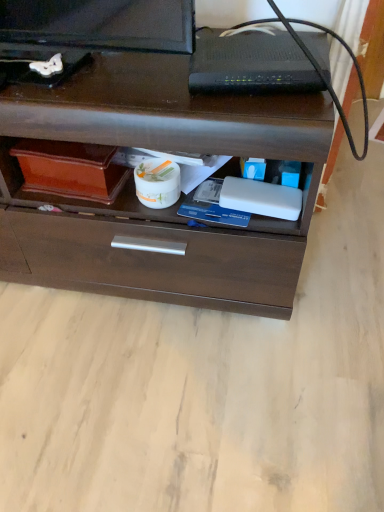
This screenshot has height=512, width=384. Describe the element at coordinates (251, 64) in the screenshot. I see `black plastic router at upper center` at that location.

Image resolution: width=384 pixels, height=512 pixels. What are the coordinates of `black plastic router at upper center` in the screenshot? It's located at point(251,64).

What is the approximate width of black plastic router at upper center?

7.03 inches.

The image size is (384, 512). What do you see at coordinates (163, 209) in the screenshot? I see `brown wood chest of drawers at center` at bounding box center [163, 209].

You are a GUI agent. You are given a task and a screenshot of the screen. Output one action in this format:
    pyautogui.click(x=<x>, y=<y>)
    Task: Click on the brown wood chest of drawers at center
    
    Given the screenshot: What is the action you would take?
    pos(163,209)

In order to click on black plastic router at upper center in this screenshot , I will do `click(251, 64)`.

Is brown wood chest of drawers at center at the right side of black plastic router at upper center?

No, brown wood chest of drawers at center is not to the right of black plastic router at upper center.

Who is more distant, brown wood chest of drawers at center or black plastic router at upper center?

Positioned behind is black plastic router at upper center.

Is point (53, 267) in front of point (200, 87)?

No, (53, 267) is further to viewer.

From the image's perspective, does brown wood chest of drawers at center appear higher than black plastic router at upper center?

Incorrect, from the image's perspective, brown wood chest of drawers at center is lower than black plastic router at upper center.

From a real-world perspective, is brown wood chest of drawers at center under black plastic router at upper center?

Indeed, from a real-world perspective, brown wood chest of drawers at center is positioned beneath black plastic router at upper center.

Is brown wood chest of drawers at center thinner than black plastic router at upper center?

Incorrect, the width of brown wood chest of drawers at center is not less than that of black plastic router at upper center.

Which of these two, brown wood chest of drawers at center or black plastic router at upper center, stands shorter?

black plastic router at upper center is shorter.

Which of these two, brown wood chest of drawers at center or black plastic router at upper center, is bigger?

With larger size is brown wood chest of drawers at center.

Is brown wood chest of drawers at center outside of black plastic router at upper center?

That's correct, brown wood chest of drawers at center is outside of black plastic router at upper center.

Are brown wood chest of drawers at center and black plastic router at upper center making contact?

No, brown wood chest of drawers at center is not with black plastic router at upper center.

Is black plastic router at upper center at the back of brown wood chest of drawers at center?

Result: No, brown wood chest of drawers at center is not facing the opposite direction of black plastic router at upper center.

How many degrees apart are the facing directions of brown wood chest of drawers at center and black plastic router at upper center?

The angular difference between brown wood chest of drawers at center and black plastic router at upper center is 8.14 degrees.

You are a GUI agent. You are given a task and a screenshot of the screen. Output one action in this format:
    pyautogui.click(x=<x>, y=<y>)
    Task: Click on the chest of drawers on the left of black plastic router at upper center
    
    Given the screenshot: What is the action you would take?
    pyautogui.click(x=163, y=209)

Does black plastic router at upper center appear on the right side of brown wood chest of drawers at center?

Yes, black plastic router at upper center is to the right of brown wood chest of drawers at center.

Considering the relative positions of black plastic router at upper center and brown wood chest of drawers at center in the image provided, is black plastic router at upper center in front of brown wood chest of drawers at center?

No, black plastic router at upper center is further to the viewer.

Is point (238, 89) farther from camera compared to point (42, 232)?

No, (238, 89) is in front of (42, 232).

From the image's perspective, relative to brown wood chest of drawers at center, is black plastic router at upper center above or below?

From the image's perspective, black plastic router at upper center appears above brown wood chest of drawers at center.

From a real-world perspective, is black plastic router at upper center beneath brown wood chest of drawers at center?

Actually, black plastic router at upper center is physically above brown wood chest of drawers at center in the real world.

Considering the relative sizes of black plastic router at upper center and brown wood chest of drawers at center in the image provided, is black plastic router at upper center wider than brown wood chest of drawers at center?

No.

Considering the sizes of objects black plastic router at upper center and brown wood chest of drawers at center in the image provided, who is shorter, black plastic router at upper center or brown wood chest of drawers at center?

Standing shorter between the two is black plastic router at upper center.

From the picture: Does black plastic router at upper center have a smaller size compared to brown wood chest of drawers at center?

Yes, black plastic router at upper center is smaller than brown wood chest of drawers at center.

Is brown wood chest of drawers at center completely or partially inside black plastic router at upper center?

Definitely not — brown wood chest of drawers at center is not inside black plastic router at upper center.

Is black plastic router at upper center with brown wood chest of drawers at center?

No, black plastic router at upper center is not beside brown wood chest of drawers at center.

Is black plastic router at upper center turned away from brown wood chest of drawers at center?

No, black plastic router at upper center's orientation is not away from brown wood chest of drawers at center.

What's the angular difference between black plastic router at upper center and brown wood chest of drawers at center's facing directions?

black plastic router at upper center and brown wood chest of drawers at center are facing 8.14 degrees away from each other.

The height and width of the screenshot is (512, 384). In order to click on appliance to the right of brown wood chest of drawers at center in this screenshot , I will do `click(251, 64)`.

The width and height of the screenshot is (384, 512). What are the coordinates of `appliance above the brown wood chest of drawers at center (from the image's perspective)` in the screenshot? It's located at (251, 64).

Identify the location of the chest of drawers that appears in front of the black plastic router at upper center. 163,209.